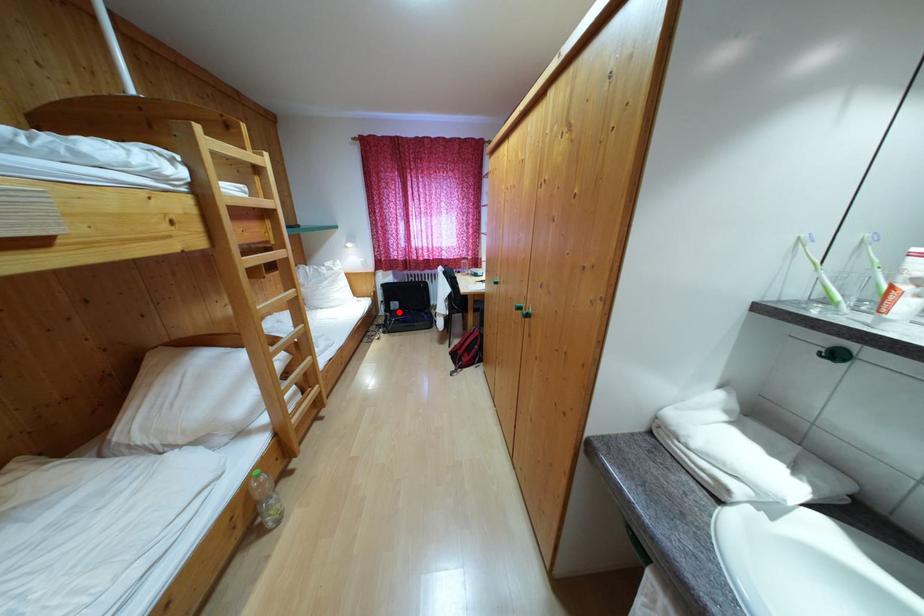
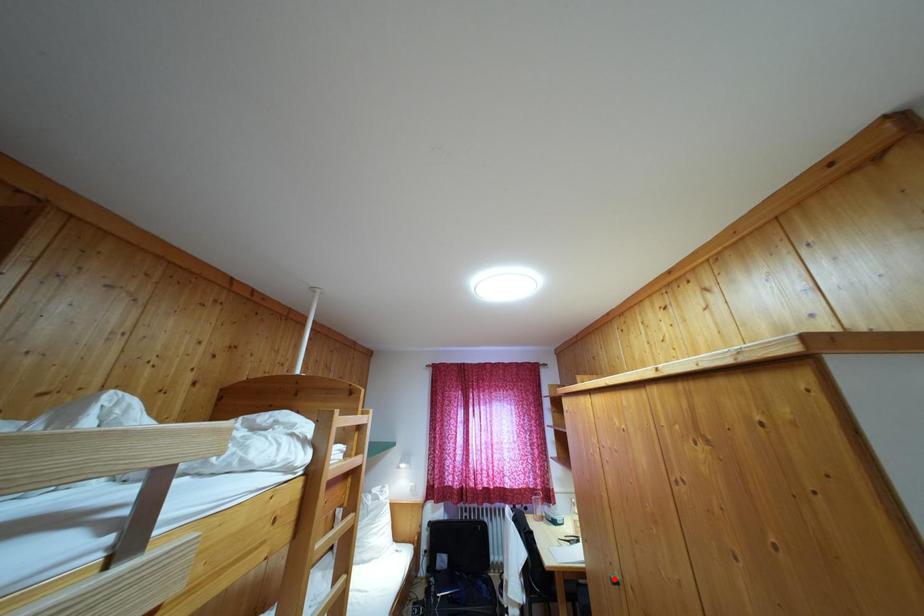
I am providing you with two images of the same scene from different viewpoints. A red point is marked on the first image and another point is marked on the second image. Is the marked point in image1 the same physical position as the marked point in image2?

No